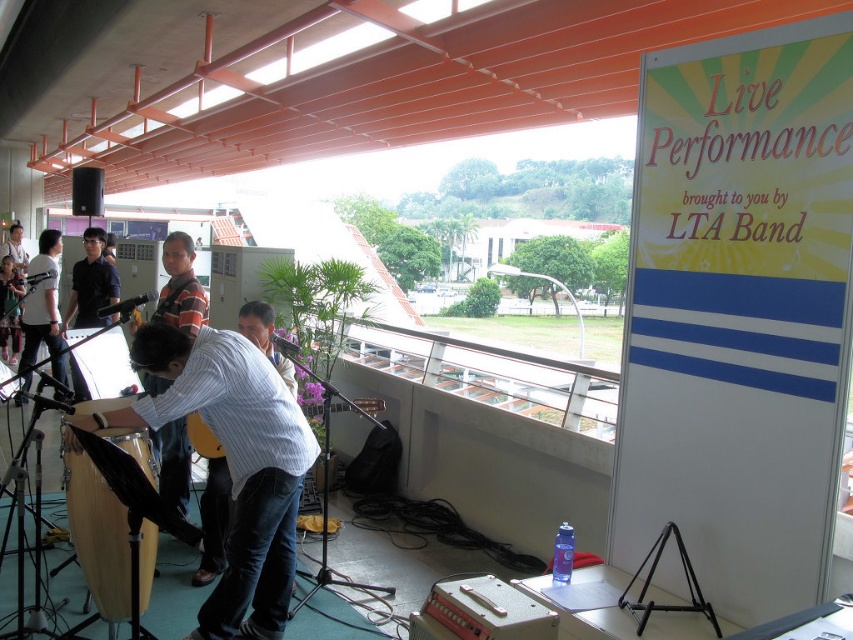
You are a photographer at the live performance setup. You need to position your camera to capture the blue striped shirt at center. What are the 2D coordinates where you should aim your camera?

The blue striped shirt at center is located at the 2D coordinates point (212, 506), so you should aim your camera at that point.

You are a photographer at the live performance. You want to take a photo of the blue striped shirt at center and the matte white shirt at left. Which one is closer to the camera?

The blue striped shirt at center is closer to the camera because it is in front of the matte white shirt at left.

You are a stagehand setting up the sound equipment. You need to place a new microphone stand between the wooden drum at lower left and the light brown leather guitar at center. According to their positions, which object should the microphone stand be closer to?

The wooden drum at lower left is below the light brown leather guitar at center, so the microphone stand should be placed closer to the wooden drum at lower left since it is positioned lower.